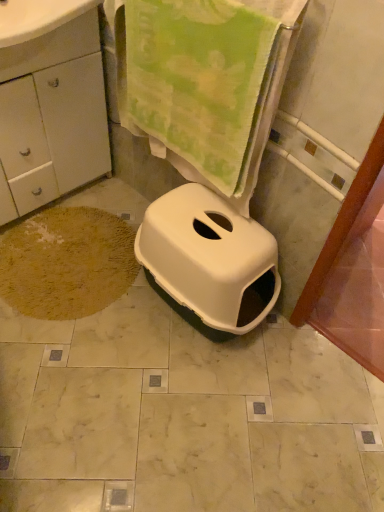
Question: Is white plastic litter box at center inside or outside of brown shaggy rug at lower left?

Choices:
 (A) inside
 (B) outside

Answer: (B)

Question: In the image, is white plastic litter box at center on the left side or the right side of brown shaggy rug at lower left?

Choices:
 (A) right
 (B) left

Answer: (A)

Question: Considering the real-world distances, which object is closest to the white glossy drawer at upper left?

Choices:
 (A) brown shaggy rug at lower left
 (B) green plush towel at upper center
 (C) white matte cabinet at lower left
 (D) white plastic litter box at center

Answer: (C)

Question: Considering the real-world distances, which object is farthest from the white glossy drawer at upper left?

Choices:
 (A) white plastic litter box at center
 (B) white matte cabinet at lower left
 (C) green plush towel at upper center
 (D) brown shaggy rug at lower left

Answer: (A)